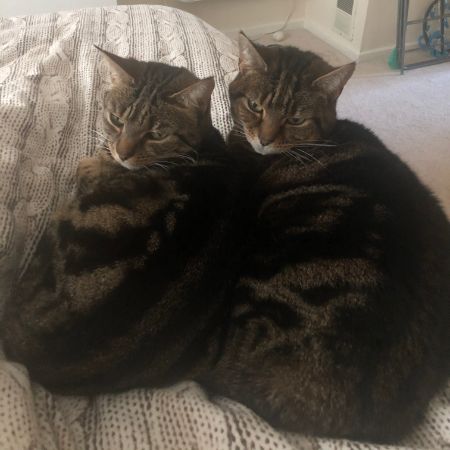
Find the location of a particular element. wall is located at coordinates (372, 20), (318, 15), (267, 10).